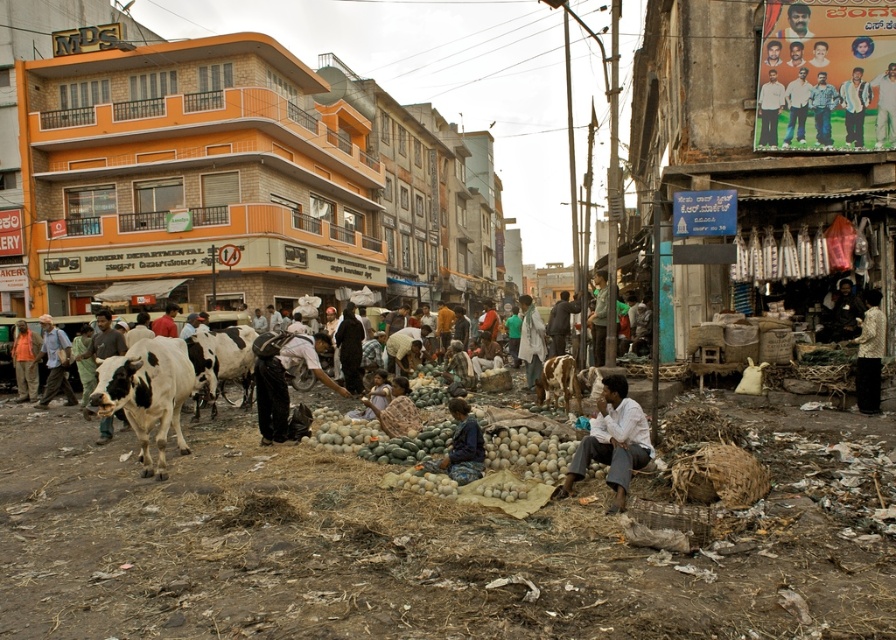
Can you confirm if light brown wooden signboard at upper right is positioned to the right of dark blue shirt at center?

Correct, you'll find light brown wooden signboard at upper right to the right of dark blue shirt at center.

Describe the element at coordinates (885, 106) in the screenshot. I see `light brown wooden signboard at upper right` at that location.

Describe the element at coordinates (885, 106) in the screenshot. I see `light brown wooden signboard at upper right` at that location.

The image size is (896, 640). I want to click on light brown wooden signboard at upper right, so click(885, 106).

Does blue fabric bag at center have a greater width compared to denim shirt at upper right?

Yes.

Locate an element on the screen. This screenshot has width=896, height=640. blue fabric bag at center is located at coordinates click(461, 445).

Image resolution: width=896 pixels, height=640 pixels. Find the location of `blue fabric bag at center`. blue fabric bag at center is located at coordinates (461, 445).

Which is in front, point (605, 301) or point (556, 307)?

Positioned in front is point (556, 307).

Does light brown fabric shirt at center lie behind dark blue shirt at center?

Yes, light brown fabric shirt at center is behind dark blue shirt at center.

What do you see at coordinates (599, 316) in the screenshot? This screenshot has width=896, height=640. I see `light brown fabric shirt at center` at bounding box center [599, 316].

Locate an element on the screen. This screenshot has width=896, height=640. light brown fabric shirt at center is located at coordinates (599, 316).